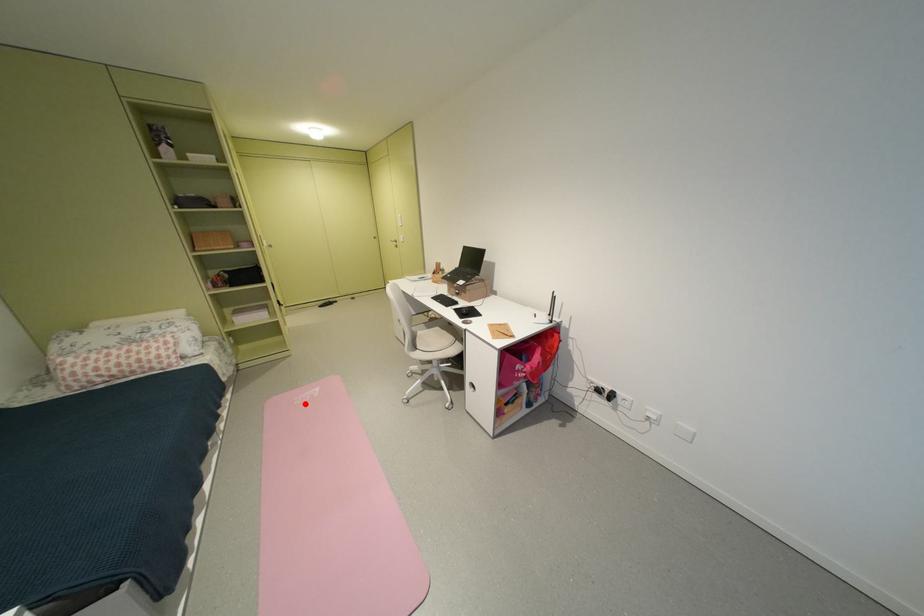
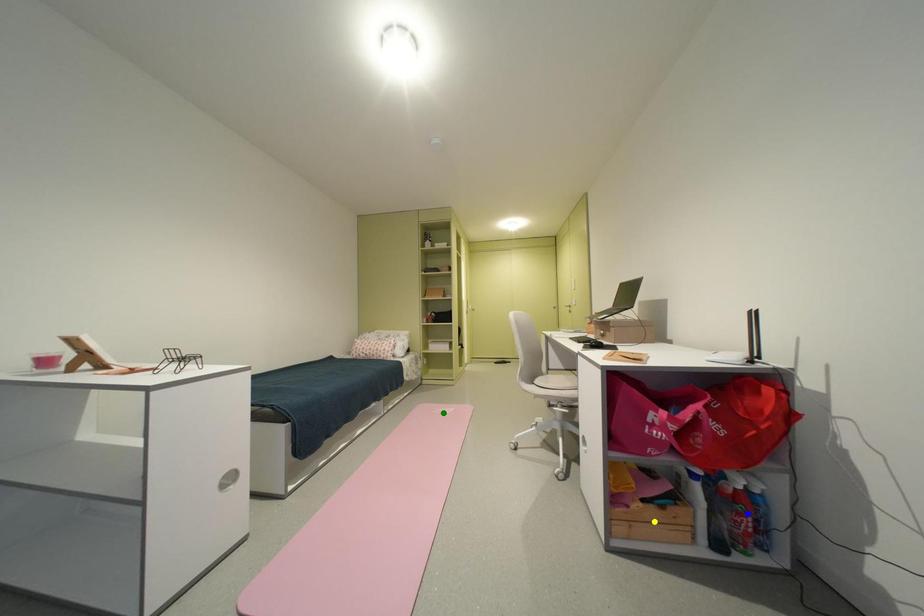
Question: I am providing you with two images of the same scene from different viewpoints. A red point is marked on the first image. You are given multiple points on the second image. Which point in image 2 represents the same 3d spot as the red point in image 1?

Choices:
 (A) green point
 (B) blue point
 (C) yellow point

Answer: (A)